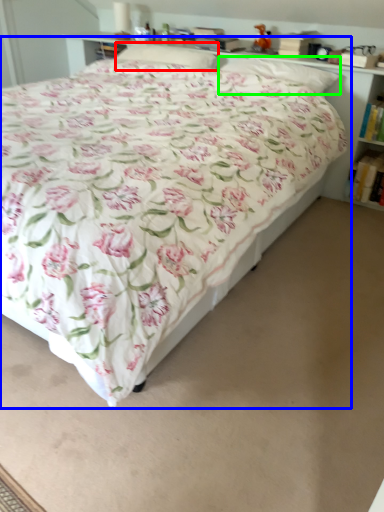
Question: Considering the real-world distances, which object is farthest from pillow (highlighted by a red box)? bed (highlighted by a blue box) or pillow (highlighted by a green box)?

Choices:
 (A) bed
 (B) pillow

Answer: (A)